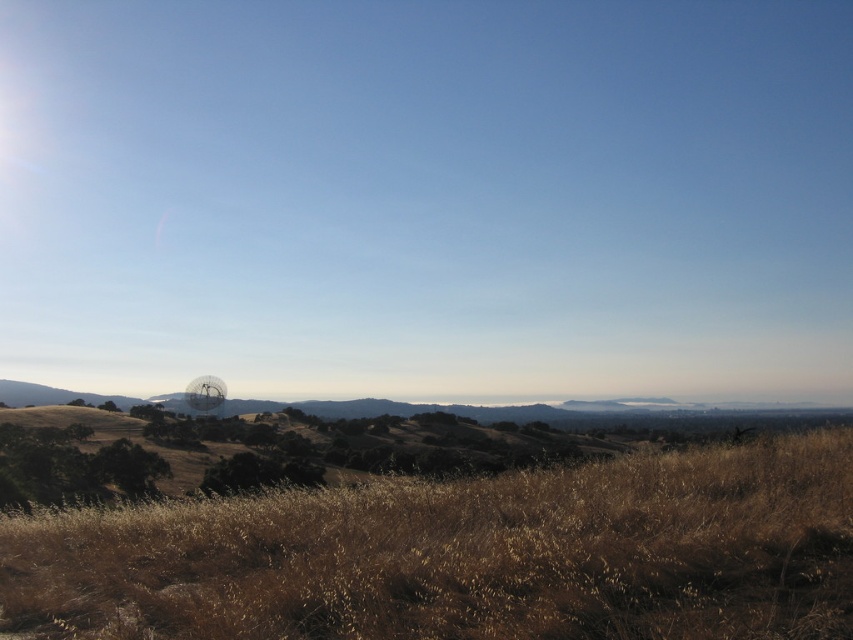
You are standing at the point labeled point (x=465, y=556) in the image. What type of terrain are you currently standing on?

The point (x=465, y=556) is on brown dry grass at lower center, so you are standing on brown dry grass.